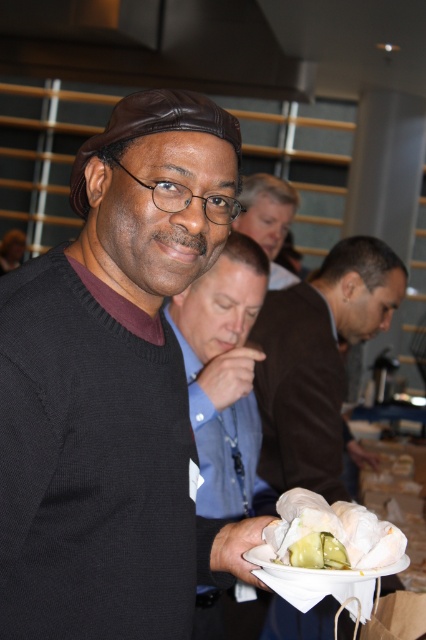
Question: Is matte black sweater at center bigger than white paper plate at lower center?

Choices:
 (A) no
 (B) yes

Answer: (B)

Question: From the image, what is the correct spatial relationship of black matte sweater at center in relation to matte black sweater at center?

Choices:
 (A) above
 (B) below

Answer: (A)

Question: Can you confirm if matte black sweater at center is thinner than brown leather jacket at upper center?

Choices:
 (A) yes
 (B) no

Answer: (A)

Question: Which of the following is the closest to the observer?

Choices:
 (A) white paper plate at lower center
 (B) black matte sweater at center
 (C) brown leather jacket at center
 (D) white paper wrapped sandwich at lower center

Answer: (B)

Question: Among these points, which one is nearest to the camera?

Choices:
 (A) (242, 225)
 (B) (382, 292)
 (C) (167, 316)

Answer: (C)

Question: Which object is farther from the camera taking this photo?

Choices:
 (A) white paper wrapped sandwich at lower center
 (B) brown leather jacket at upper center

Answer: (B)